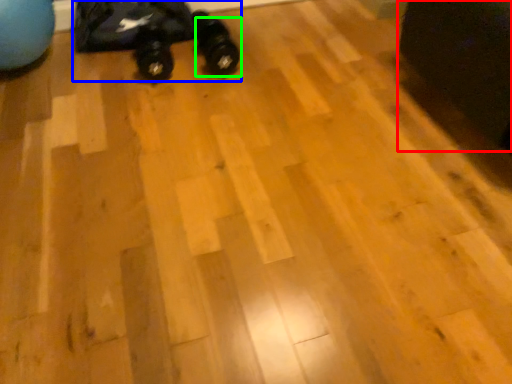
Question: Which object is the farthest from swivel chair (highlighted by a red box)? Choose among these: toy car (highlighted by a blue box) or footwear (highlighted by a green box).

Choices:
 (A) toy car
 (B) footwear

Answer: (A)